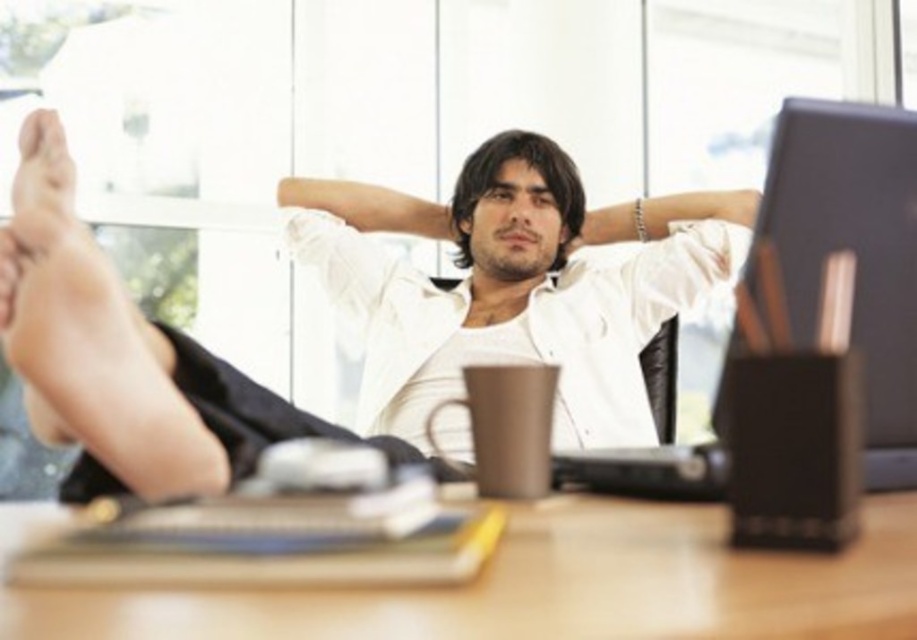
You are standing 20 inches away from the desk in the home office scene. There is a point labeled as point (26, 272). Is this point within your reach?

The point (26, 272) is 30.43 inches away from the viewer. Since you are standing 20 inches away from the desk, the point is 10.43 inches beyond your current position. Therefore, it is not within your immediate reach unless you move closer.

You are standing in a home office and want to place a new item at the point with coordinates [550,586]. What object is located at that position?

The point at coordinates [550,586] corresponds to the wooden table at center.